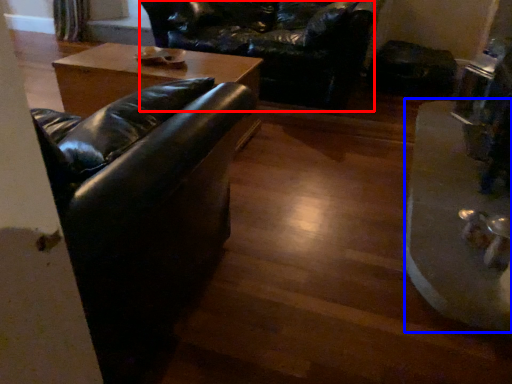
Question: Which of the following is the closest to the observer, swivel chair (highlighted by a red box) or wide (highlighted by a blue box)?

Choices:
 (A) swivel chair
 (B) wide

Answer: (B)